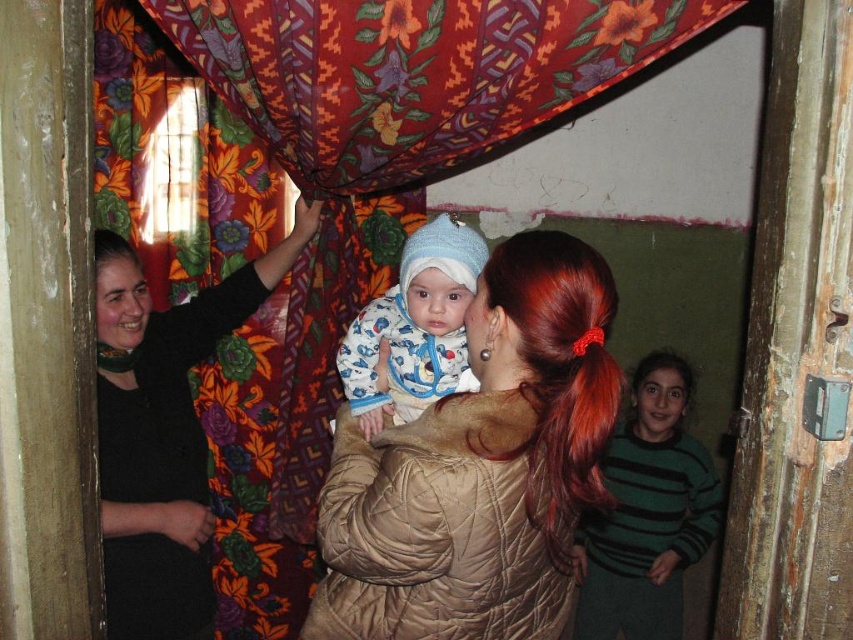
You are a delivery person who needs to place a small package between the green striped sweater at right and the knitted blue hat at center. The package is 1.2 meters long. Can you fit it between them without moving either object?

The distance between the green striped sweater at right and the knitted blue hat at center is 1.35 meters. Since the package is 1.2 meters long, it can fit between them as there is enough space.

You are a photographer who wants to capture the baby in the knitted blue hat at center without the black fabric at left being in the frame. Based on their sizes, which object should you focus on to ensure the baby is centered and the black fabric is out of view?

The black fabric at left is bigger than the knitted blue hat at center, so focusing on the knitted blue hat at center and adjusting the camera angle to avoid the larger black fabric at left would keep the baby centered while excluding the black fabric from the frame.